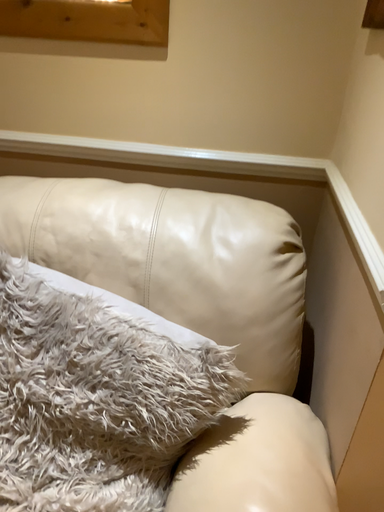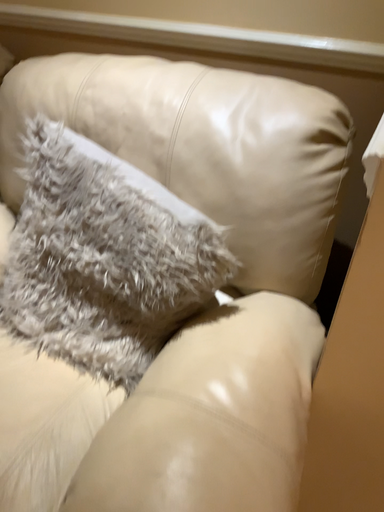
Question: How did the camera likely rotate when shooting the video?

Choices:
 (A) rotated upward
 (B) rotated downward

Answer: (B)